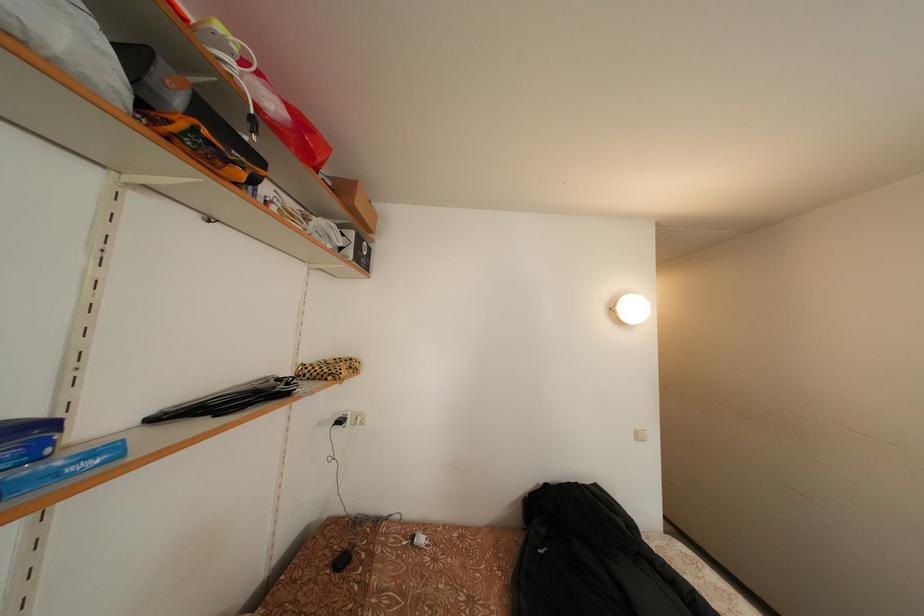
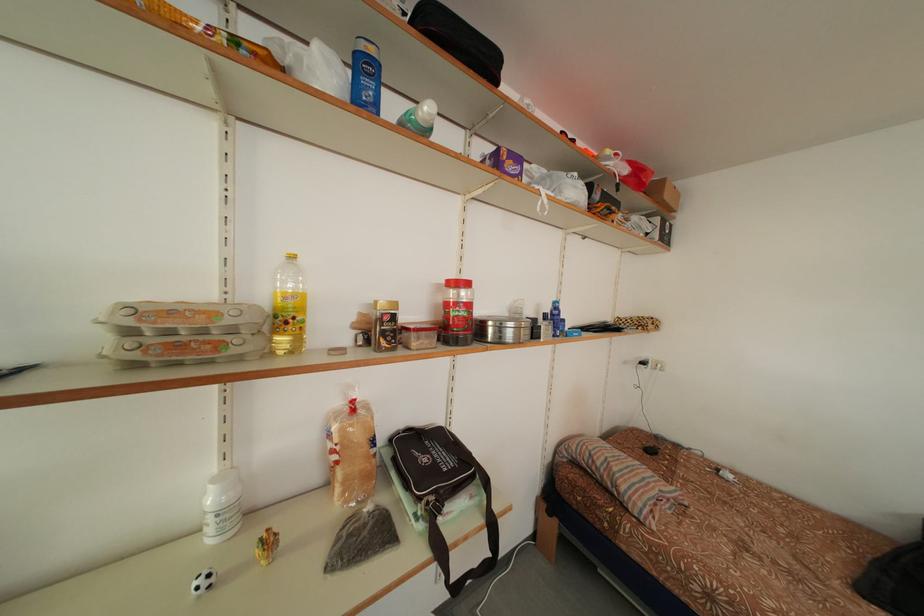
In the second image, find the point that corresponds to point (368, 209) in the first image.

(675, 201)